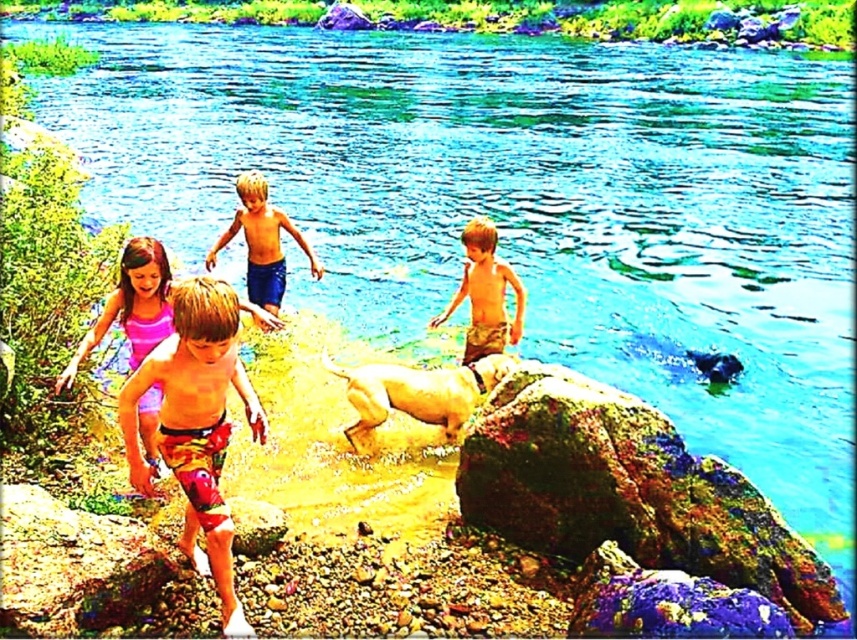
Between multicolored textured rock at lower right and camouflage shorts at center, which one appears on the right side from the viewer's perspective?

multicolored textured rock at lower right is more to the right.

Which is in front, point (630, 506) or point (472, 326)?

Point (630, 506)

At what (x,y) coordinates should I click in order to perform the action: click on multicolored textured rock at lower right. Please return your answer as a coordinate pair (x, y). Looking at the image, I should click on (627, 492).

Is multicolored swim trunks at center positioned in front of smooth brown rock at lower left?

Yes, multicolored swim trunks at center is closer to the viewer.

What do you see at coordinates (196, 422) in the screenshot? I see `multicolored swim trunks at center` at bounding box center [196, 422].

Find the location of a particular element. multicolored swim trunks at center is located at coordinates (196, 422).

Who is lower down, multicolored textured rock at lower right or smooth brown rock at lower left?

smooth brown rock at lower left is lower down.

The height and width of the screenshot is (640, 857). What are the coordinates of `multicolored textured rock at lower right` in the screenshot? It's located at (627, 492).